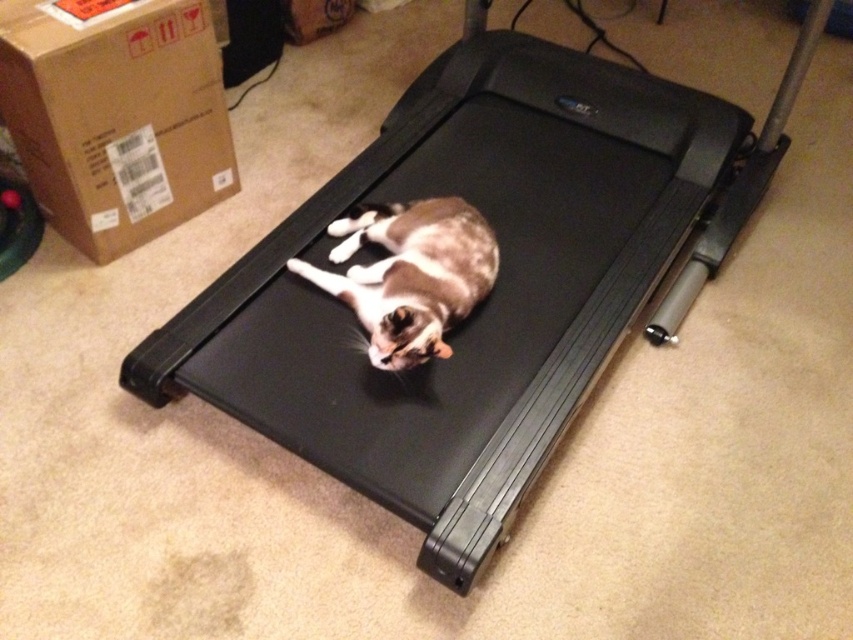
Question: Is brown cardboard box at upper left below brown and white fur cat at center?

Choices:
 (A) no
 (B) yes

Answer: (A)

Question: Which of the following is the farthest from the observer?

Choices:
 (A) (24, 140)
 (B) (410, 232)

Answer: (A)

Question: From the image, what is the correct spatial relationship of brown cardboard box at upper left in relation to brown and white fur cat at center?

Choices:
 (A) right
 (B) left

Answer: (B)

Question: Is brown cardboard box at upper left wider than brown and white fur cat at center?

Choices:
 (A) no
 (B) yes

Answer: (B)

Question: Among these points, which one is farthest from the camera?

Choices:
 (A) (289, 260)
 (B) (68, 35)

Answer: (A)

Question: Which point is farther from the camera taking this photo?

Choices:
 (A) (345, 230)
 (B) (42, 208)

Answer: (B)